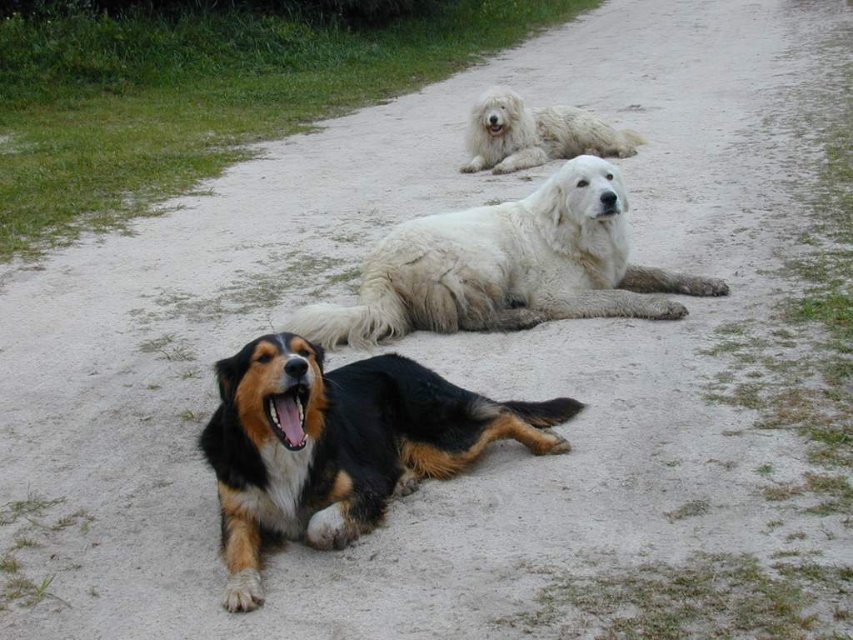
Question: Among these points, which one is nearest to the camera?

Choices:
 (A) tap(630, 314)
 (B) tap(381, 388)

Answer: (B)

Question: Considering the real-world distances, which object is farthest from the white fluffy dog at upper center?

Choices:
 (A) tri-colored fur dog at center
 (B) white fluffy dog at center

Answer: (A)

Question: Does tri-colored fur dog at center appear over white fluffy dog at upper center?

Choices:
 (A) yes
 (B) no

Answer: (B)

Question: Does tri-colored fur dog at center have a smaller size compared to white fluffy dog at center?

Choices:
 (A) no
 (B) yes

Answer: (B)

Question: Which object is the farthest from the tri-colored fur dog at center?

Choices:
 (A) white fluffy dog at center
 (B) white fluffy dog at upper center

Answer: (B)

Question: Where is tri-colored fur dog at center located in relation to white fluffy dog at center in the image?

Choices:
 (A) below
 (B) above

Answer: (A)